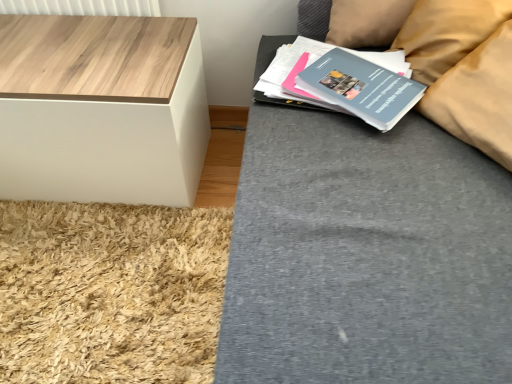
I want to click on free space above matte blue paperback book at upper right, the 2th paperback book in the front-to-back sequence (from a real-world perspective), so click(346, 70).